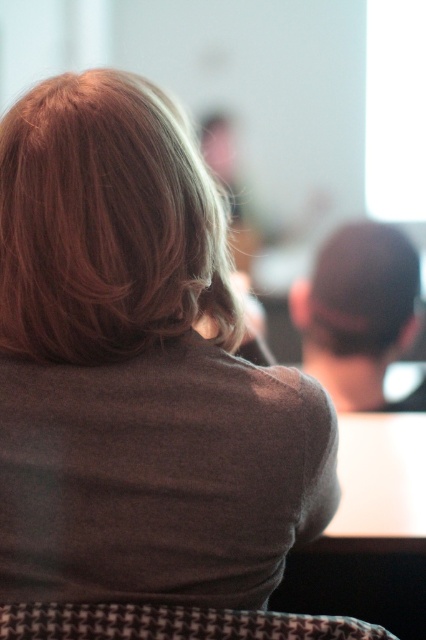
You are a photographer adjusting your camera settings to focus on the brown matte shirt at upper left and the blonde silky hair at upper left. Which object should you adjust your focus to first if you want to capture both in sharp detail?

The brown matte shirt at upper left is positioned on the right side of blonde silky hair at upper left, so you should focus on the blonde silky hair at upper left first since it is closer to the camera. This will ensure both are in focus due to the overlapping depth of field.

You are a photographer adjusting your camera settings to capture the subject in the scene. The camera is currently focused on the person in the foreground. There is a specific point of interest at point (106,225). Can you confirm if this point is within the focused area of the image?

Point (106,225) marks blonde silky hair at upper left, which is part of the subject in the foreground. Since the camera is focused on the person in the foreground, the point is within the focused area.

You are a photographer adjusting your camera settings to focus on the houndstooth fabric chair at lower center. Since the blonde silky hair at upper left is in the way, can you shift your focus to the chair without moving the camera? Explain based on their positions.

The blonde silky hair at upper left is positioned on the left side of the houndstooth fabric chair at lower center. Since the hair is to the side of the chair and not directly blocking it, you can adjust the focus to the chair at lower center without moving the camera.